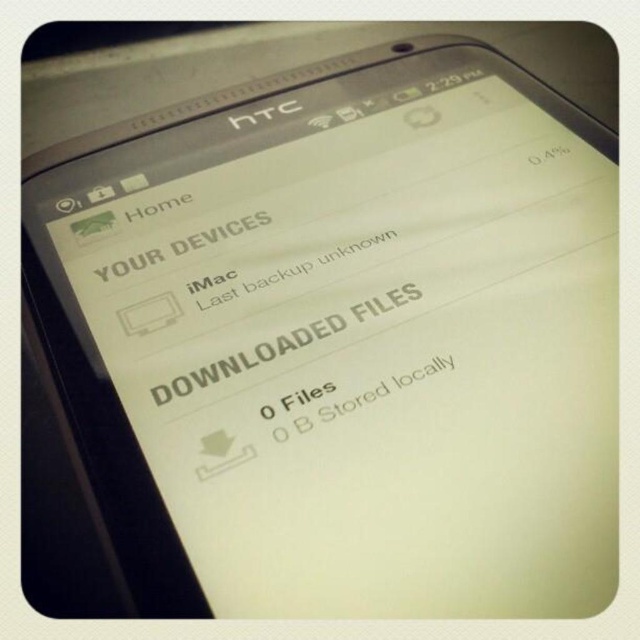
In the scene shown: Can you confirm if black paper/downloaded files at center is positioned above white matte text at upper center?

Actually, black paper/downloaded files at center is below white matte text at upper center.

Who is more distant from viewer, [388,300] or [257,218]?

Positioned behind is point [257,218].

Does point (218, 369) come behind point (141, 266)?

No, (218, 369) is in front of (141, 266).

The width and height of the screenshot is (640, 640). In order to click on black paper/downloaded files at center in this screenshot , I will do `click(280, 344)`.

Is black paper/downloaded files at center positioned before white paper at center?

No, black paper/downloaded files at center is further to the viewer.

Does black paper/downloaded files at center come behind white paper at center?

Yes.

Who is more forward, (192, 381) or (336, 387)?

Positioned in front is point (192, 381).

Where is `black paper/downloaded files at center`? The image size is (640, 640). black paper/downloaded files at center is located at coordinates (280, 344).

Does white paper at center appear on the right side of whitetext04% at upper right?

No, white paper at center is not to the right of whitetext04% at upper right.

The image size is (640, 640). In order to click on white paper at center in this screenshot , I will do `click(384, 388)`.